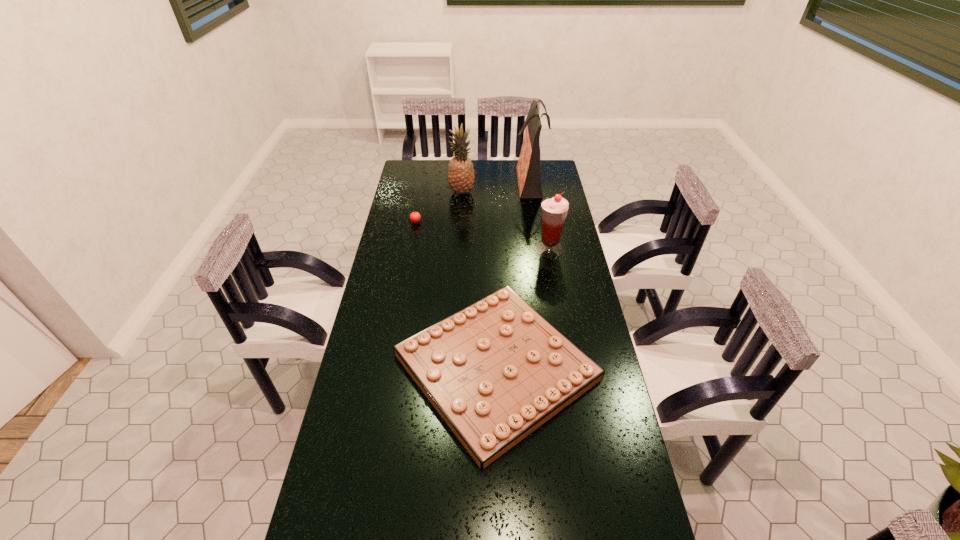
Locate an element on the screen. This screenshot has height=540, width=960. free spot located 0.150m on the front side of the shopping bag is located at coordinates (485, 180).

The width and height of the screenshot is (960, 540). I want to click on free location located 0.110m on the left of the pineapple, so 426,193.

The height and width of the screenshot is (540, 960). Find the location of `vacant space located on the left of the second nearest object`. vacant space located on the left of the second nearest object is located at coordinates (454, 249).

This screenshot has width=960, height=540. In order to click on vacant space situated 0.050m on the right of the cherry in this screenshot , I will do `click(432, 222)`.

Locate an element on the screen. Image resolution: width=960 pixels, height=540 pixels. free region located on the back of the nearest object is located at coordinates (493, 270).

Find the location of `object that is at the far edge`. object that is at the far edge is located at coordinates (528, 167).

At what (x,y) coordinates should I click in order to perform the action: click on cherry that is at the left edge. Please return your answer as a coordinate pair (x, y). Looking at the image, I should click on (415, 217).

Identify the location of gameboard located in the left edge section of the desktop. [x=495, y=371].

The image size is (960, 540). What are the coordinates of `shopping bag present at the right edge` in the screenshot? It's located at (528, 167).

Find the location of a particular element. The height and width of the screenshot is (540, 960). smoothie that is positioned at the right edge is located at coordinates (554, 210).